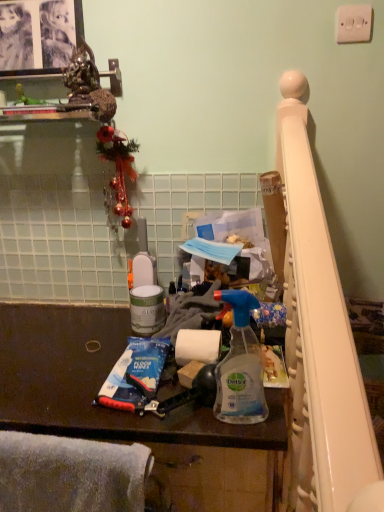
Identify the location of free space above dark brown laminate counter at center (from a real-world perspective). (76, 353).